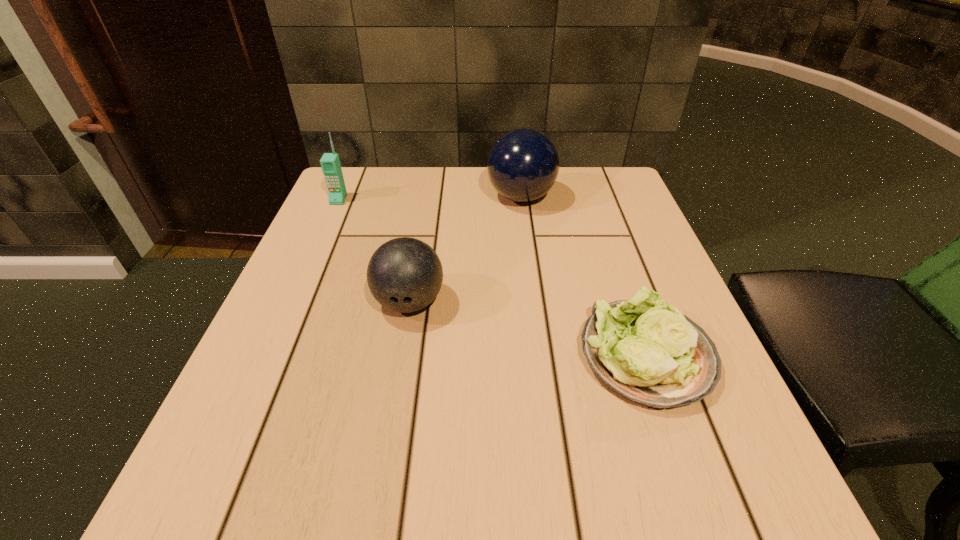
Where is `free region at the right edge of the desktop`? The height and width of the screenshot is (540, 960). free region at the right edge of the desktop is located at coordinates (587, 231).

In order to click on vacant region at the far right corner of the desktop in this screenshot , I will do `click(616, 183)`.

Where is `empty location between the shortest object and the farther bowling ball`? The width and height of the screenshot is (960, 540). empty location between the shortest object and the farther bowling ball is located at coordinates (584, 276).

This screenshot has height=540, width=960. I want to click on vacant point located between the farther bowling ball and the cellular telephone, so click(430, 199).

In order to click on vacant area that lies between the cellular telephone and the shortest object in this screenshot , I will do `click(492, 278)`.

Identify the location of free area in between the second object from left to right and the lettuce. (528, 329).

What are the coordinates of `free space between the taller bowling ball and the leftmost object` in the screenshot? It's located at (430, 199).

Where is `free spot between the left bowling ball and the farther bowling ball`? Image resolution: width=960 pixels, height=540 pixels. free spot between the left bowling ball and the farther bowling ball is located at coordinates (465, 249).

What are the coordinates of `free space between the left bowling ball and the taller bowling ball` in the screenshot? It's located at (465, 249).

Where is `empty space between the right bowling ball and the lettuce`? The image size is (960, 540). empty space between the right bowling ball and the lettuce is located at coordinates (584, 276).